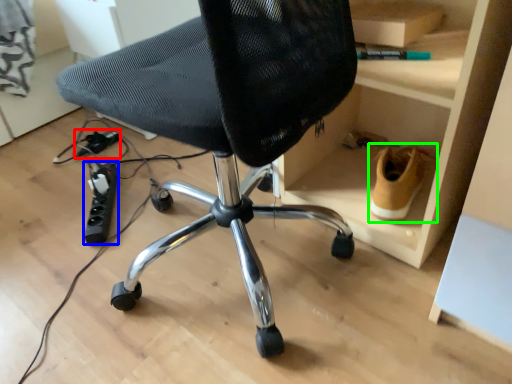
Question: Estimate the real-world distances between objects in this image. Which object is farther from plug (highlighted by a red box), plug (highlighted by a blue box) or footwear (highlighted by a green box)?

Choices:
 (A) plug
 (B) footwear

Answer: (B)